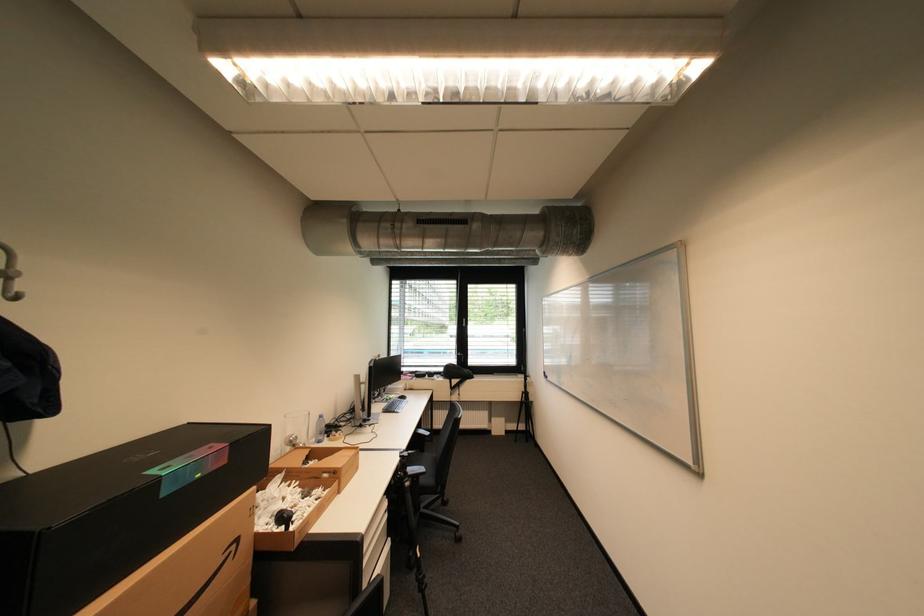
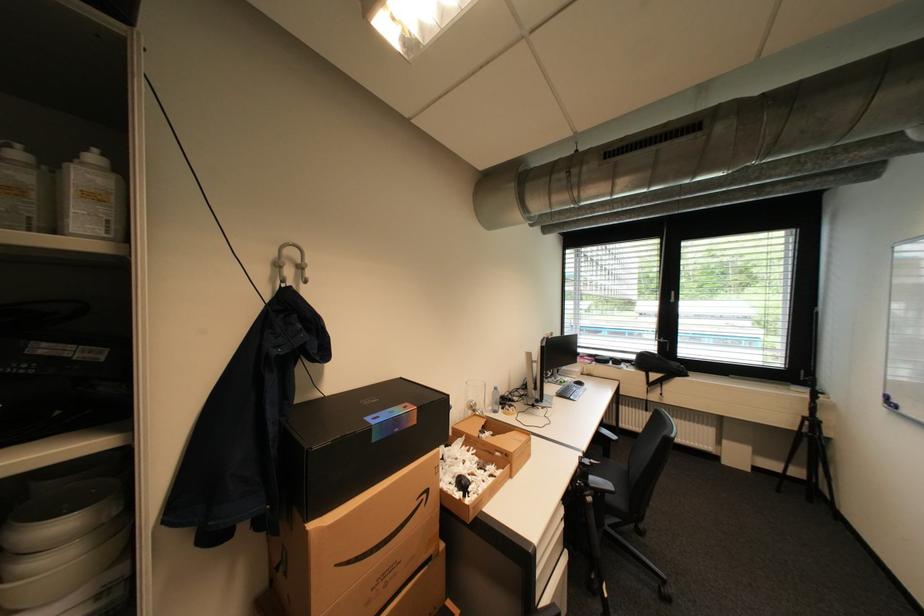
The point at (280, 517) is marked in the first image. Where is the corresponding point in the second image?

(462, 477)